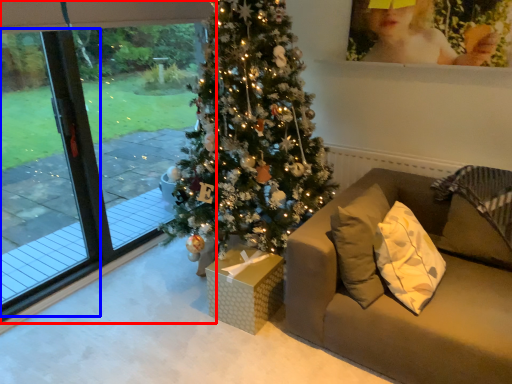
Question: Which point is closer to the camera, window (highlighted by a red box) or screen door (highlighted by a blue box)?

Choices:
 (A) window
 (B) screen door

Answer: (A)